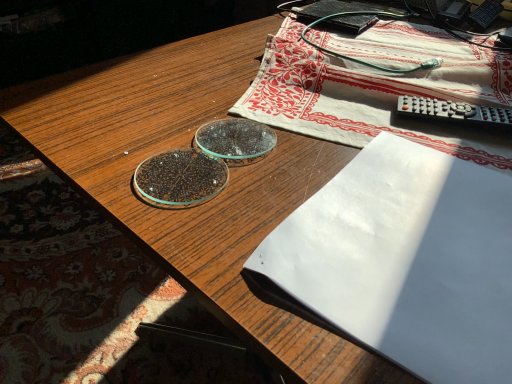
Where is `vacant area that is situated to the right of black matte paperback book at upper right`? vacant area that is situated to the right of black matte paperback book at upper right is located at coordinates (415, 33).